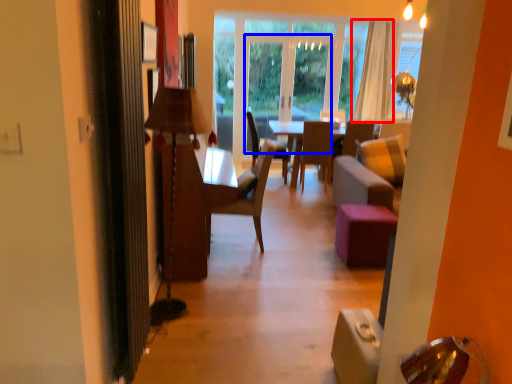
Question: Which of the following is the farthest to the observer, curtain (highlighted by a red box) or glass door (highlighted by a blue box)?

Choices:
 (A) curtain
 (B) glass door

Answer: (B)